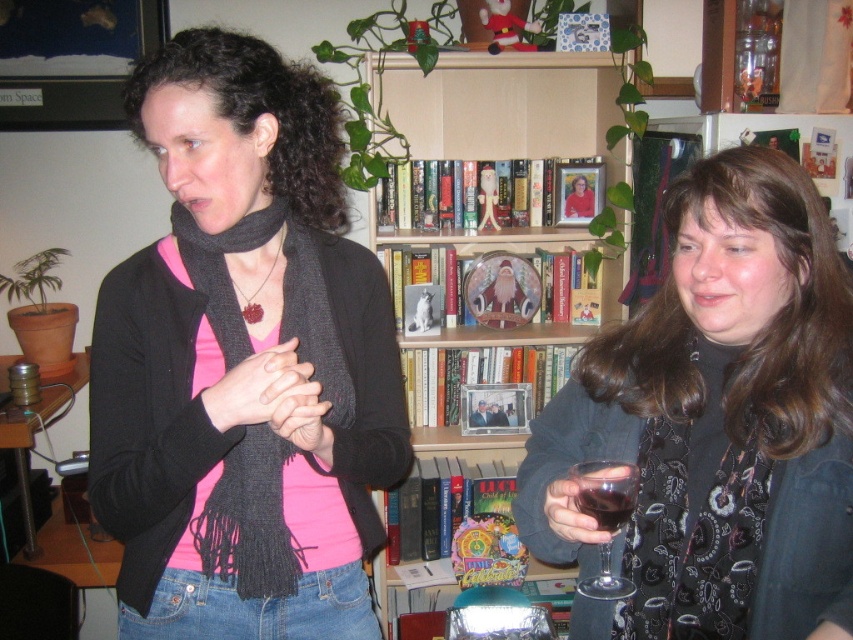
Is wooden bookshelf at center bigger than black knitted scarf at left?

Correct, wooden bookshelf at center is larger in size than black knitted scarf at left.

Between wooden bookshelf at center and black knitted scarf at left, which one is positioned lower?

Positioned lower is black knitted scarf at left.

Does point (399, 124) come behind point (260, 573)?

That is True.

The height and width of the screenshot is (640, 853). What are the coordinates of `wooden bookshelf at center` in the screenshot? It's located at (500, 102).

Is transparent glass wine glass at lower right above dark glass at right?

Actually, transparent glass wine glass at lower right is below dark glass at right.

Can you confirm if transparent glass wine glass at lower right is taller than dark glass at right?

Indeed, transparent glass wine glass at lower right has a greater height compared to dark glass at right.

Does point (604, 506) come in front of point (593, 493)?

Yes, it is.

Image resolution: width=853 pixels, height=640 pixels. I want to click on transparent glass wine glass at lower right, so click(605, 492).

Who is higher up, matte black scarf at center or dark glass at right?

matte black scarf at center is above.

Does matte black scarf at center have a lesser width compared to dark glass at right?

In fact, matte black scarf at center might be wider than dark glass at right.

Image resolution: width=853 pixels, height=640 pixels. I want to click on matte black scarf at center, so point(242,362).